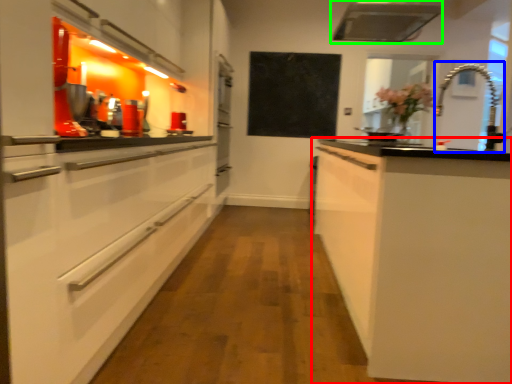
Question: Which object is the farthest from cabinetry (highlighted by a red box)? Choose among these: faucet (highlighted by a blue box) or exhaust hood (highlighted by a green box).

Choices:
 (A) faucet
 (B) exhaust hood

Answer: (A)